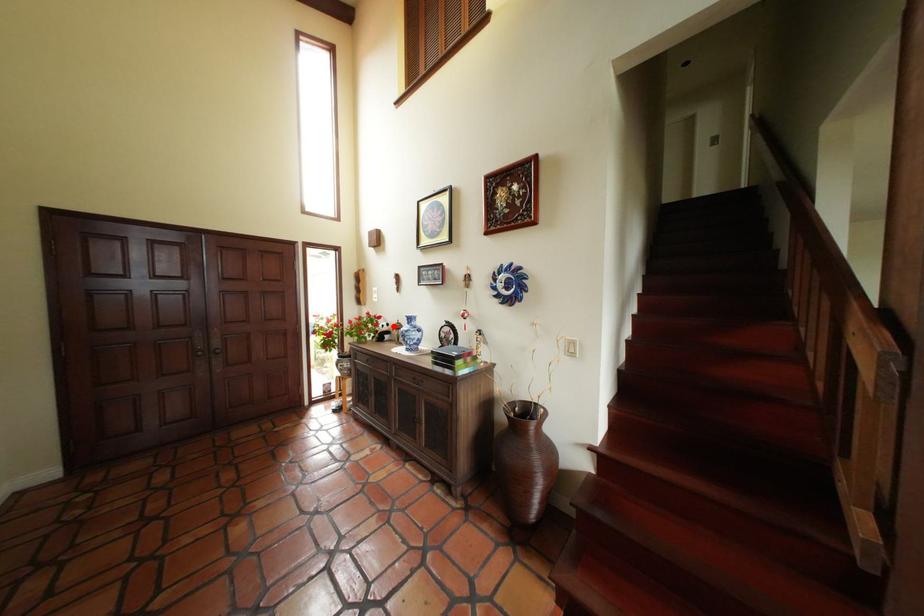
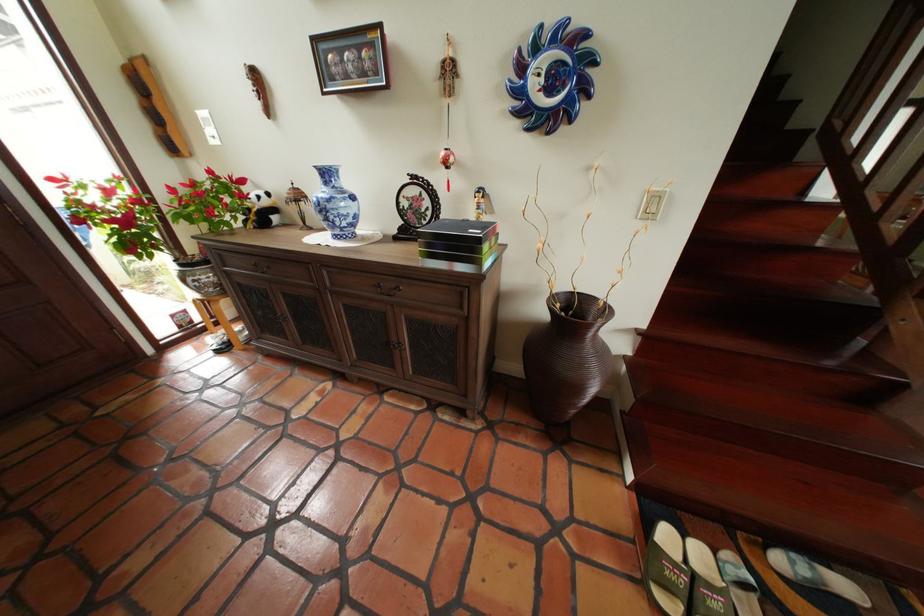
Question: I am providing you with two images of the same scene from different viewpoints. A red point is shown in image1. For the corresponding object point in image2, is it positioned nearer or farther from the camera?

Choices:
 (A) Nearer
 (B) Farther

Answer: (A)